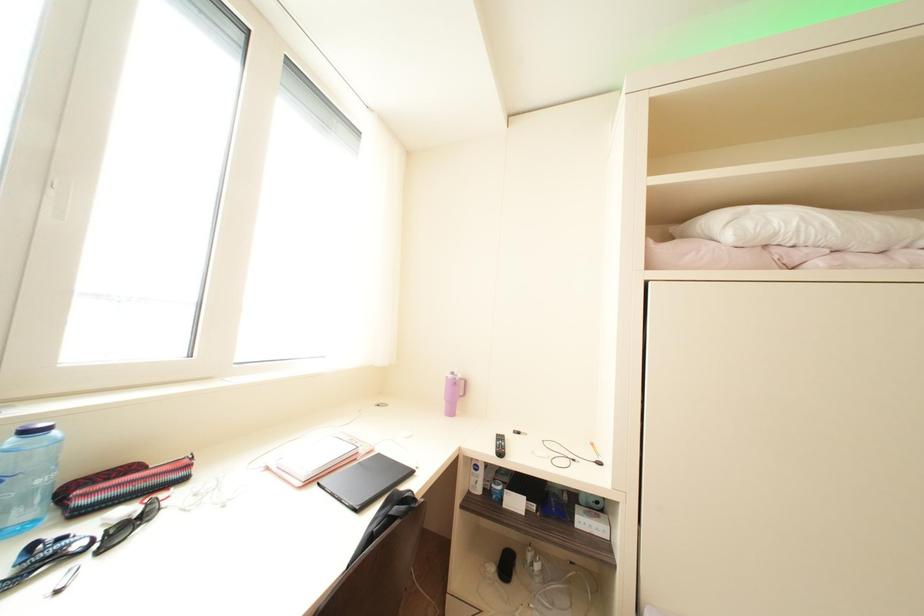
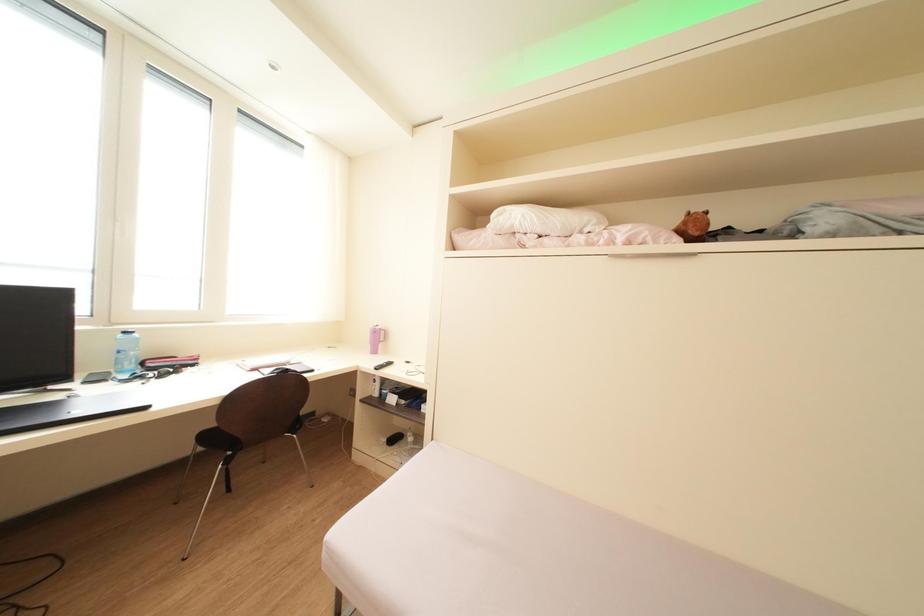
The images are taken continuously from a first-person perspective. In which direction are you moving?

The cameraman walked toward right, backward.